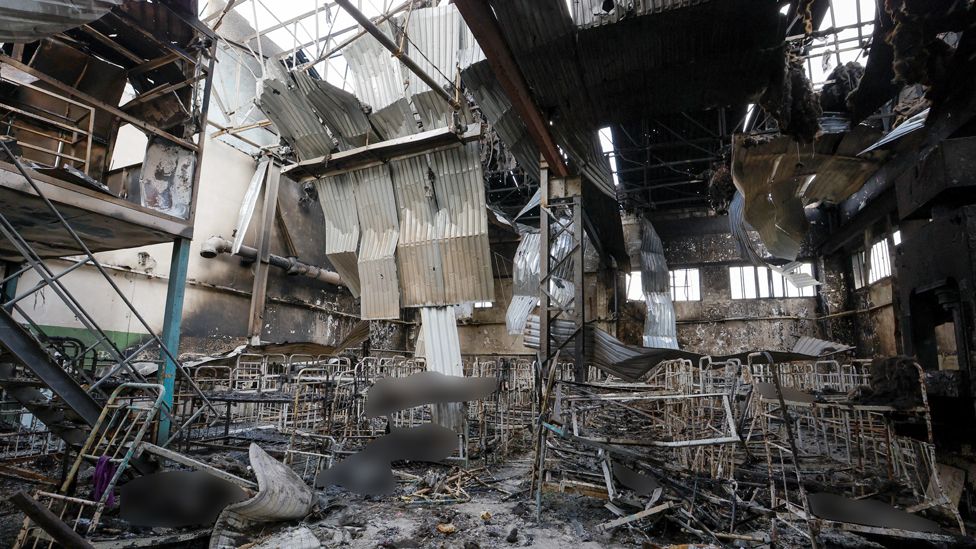
Identify the location of window. This screenshot has width=976, height=549. (878, 263), (899, 240), (775, 280), (677, 289), (478, 304).